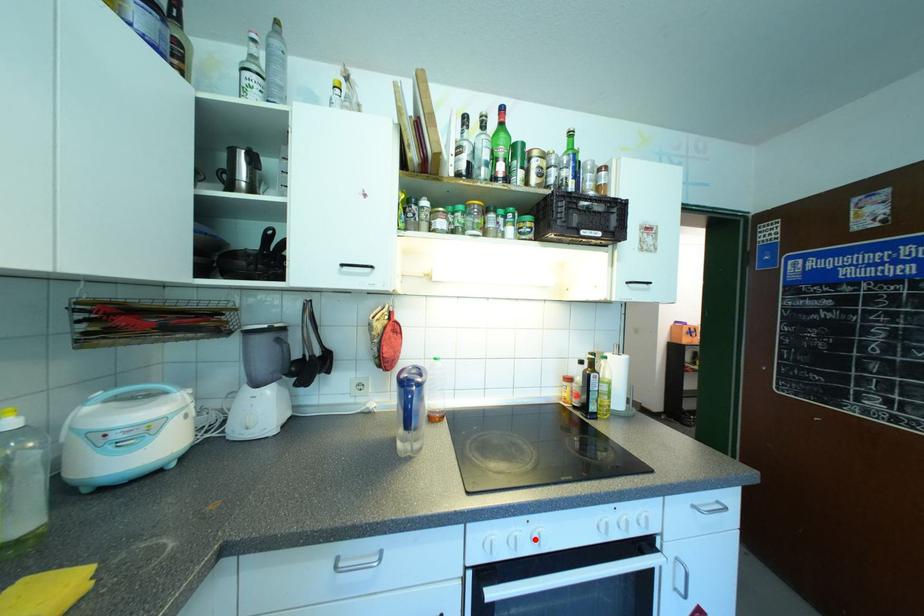
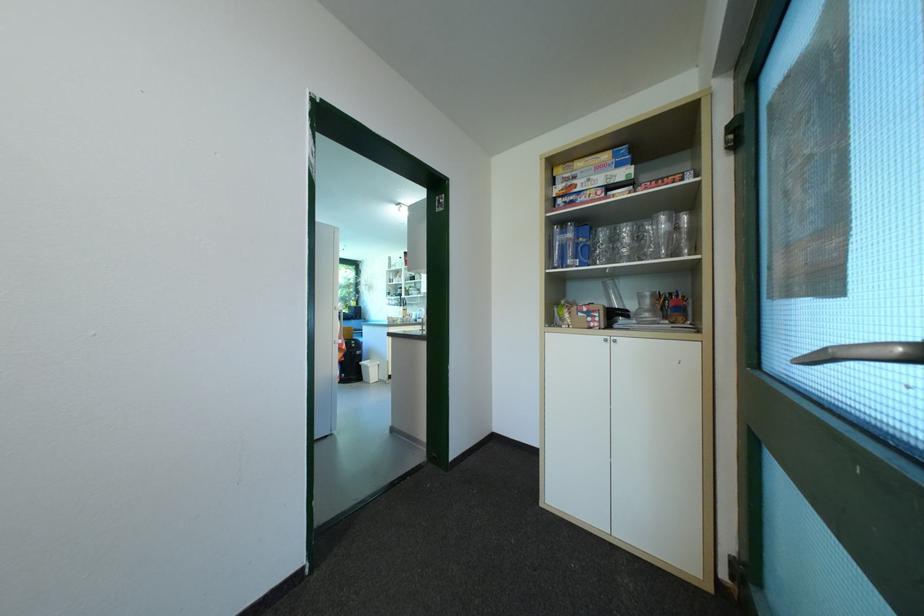
Question: I am providing you with two images of the same scene from different viewpoints. A red point is marked on the first image. Is the red point's position out of view in image 2?

Choices:
 (A) Yes
 (B) No

Answer: (A)